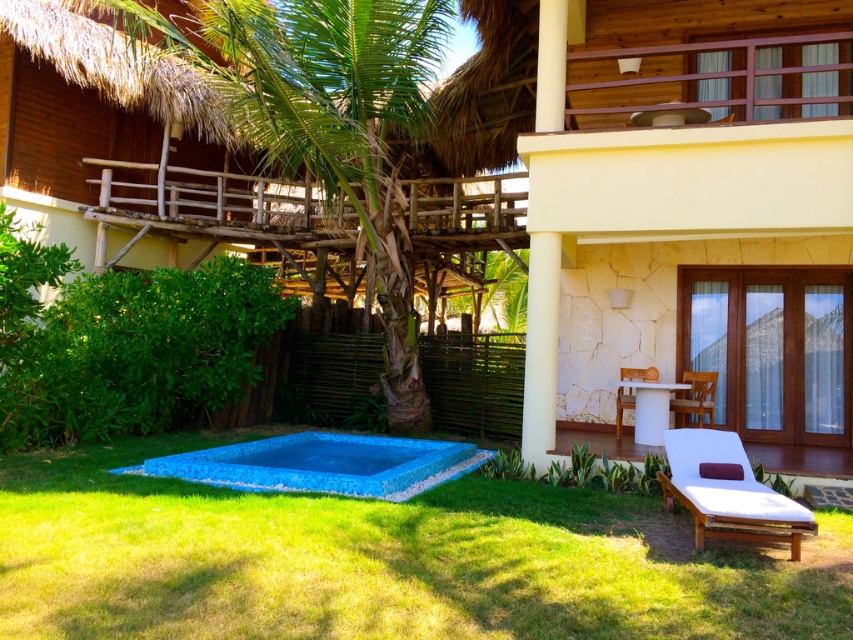
Is green grass at lower center bigger than blue mosaic tiles at center?

No.

Between green grass at lower center and blue mosaic tiles at center, which one is positioned higher?

green grass at lower center

Is point (604, 493) positioned before point (218, 464)?

Yes.

You are a GUI agent. You are given a task and a screenshot of the screen. Output one action in this format:
    pyautogui.click(x=<x>, y=<y>)
    Task: Click on the green grass at lower center
    This screenshot has height=640, width=853.
    Given the screenshot: What is the action you would take?
    pyautogui.click(x=381, y=561)

Can you confirm if green grass at lower center is shorter than white fabric chaise lounge at lower right?

Correct, green grass at lower center is not as tall as white fabric chaise lounge at lower right.

Which is above, green grass at lower center or white fabric chaise lounge at lower right?

white fabric chaise lounge at lower right

Locate an element on the screen. This screenshot has width=853, height=640. green grass at lower center is located at coordinates (381, 561).

Locate an element on the screen. The width and height of the screenshot is (853, 640). green grass at lower center is located at coordinates (381, 561).

Based on the photo, who is taller, blue mosaic tiles at center or white fabric chaise lounge at lower right?

white fabric chaise lounge at lower right

I want to click on blue mosaic tiles at center, so (x=323, y=465).

Find the location of a particular element. The width and height of the screenshot is (853, 640). blue mosaic tiles at center is located at coordinates (323, 465).